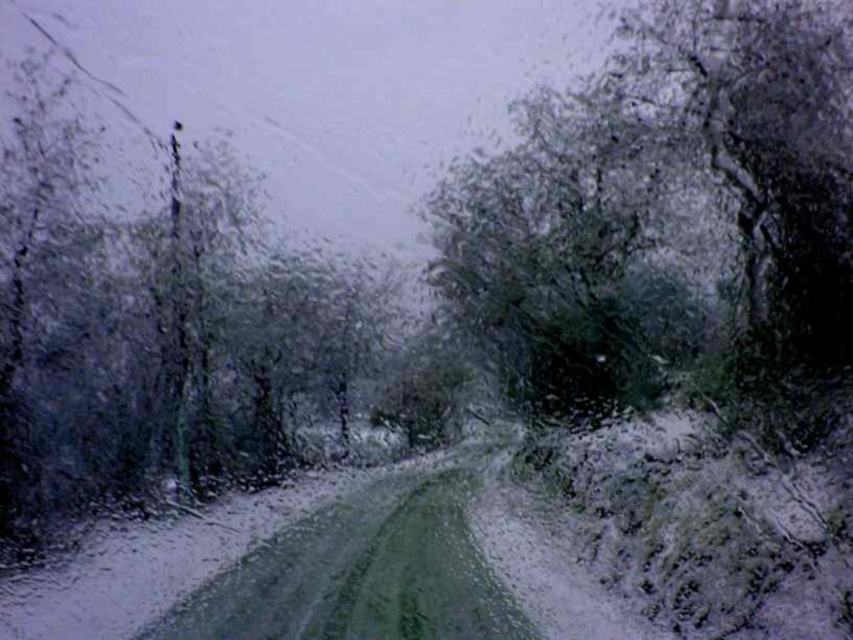
Question: Does green matte tree at upper right lie behind glossy dark green tree at upper left?

Choices:
 (A) no
 (B) yes

Answer: (A)

Question: Which object appears farthest from the camera in this image?

Choices:
 (A) green matte tree at upper right
 (B) glossy dark green tree at upper left

Answer: (B)

Question: Observing the image, what is the correct spatial positioning of green matte tree at upper right in reference to glossy dark green tree at upper left?

Choices:
 (A) right
 (B) left

Answer: (A)

Question: Does green matte tree at upper right appear over glossy dark green tree at upper left?

Choices:
 (A) no
 (B) yes

Answer: (B)